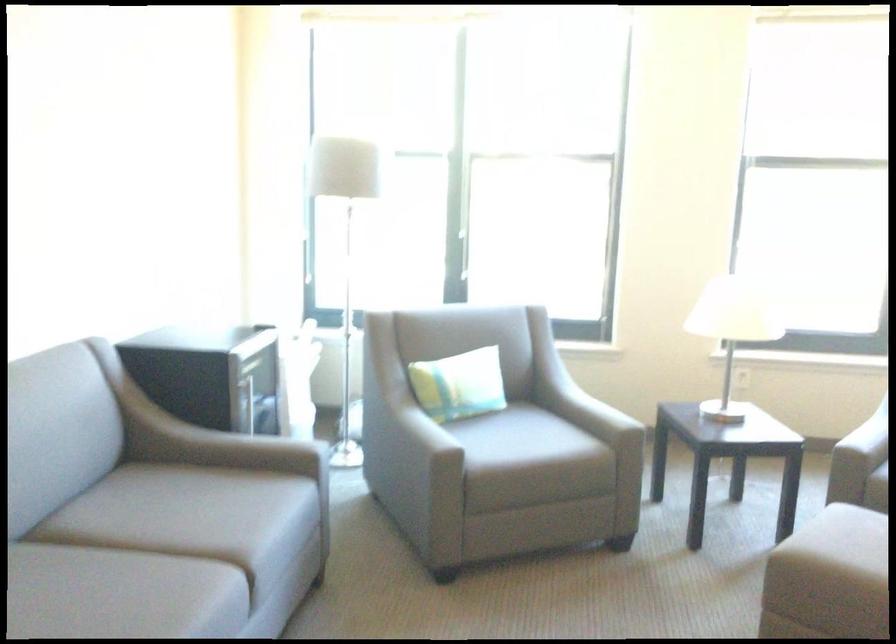
This screenshot has width=896, height=644. What do you see at coordinates (211, 444) in the screenshot?
I see `the grey sofa armrest` at bounding box center [211, 444].